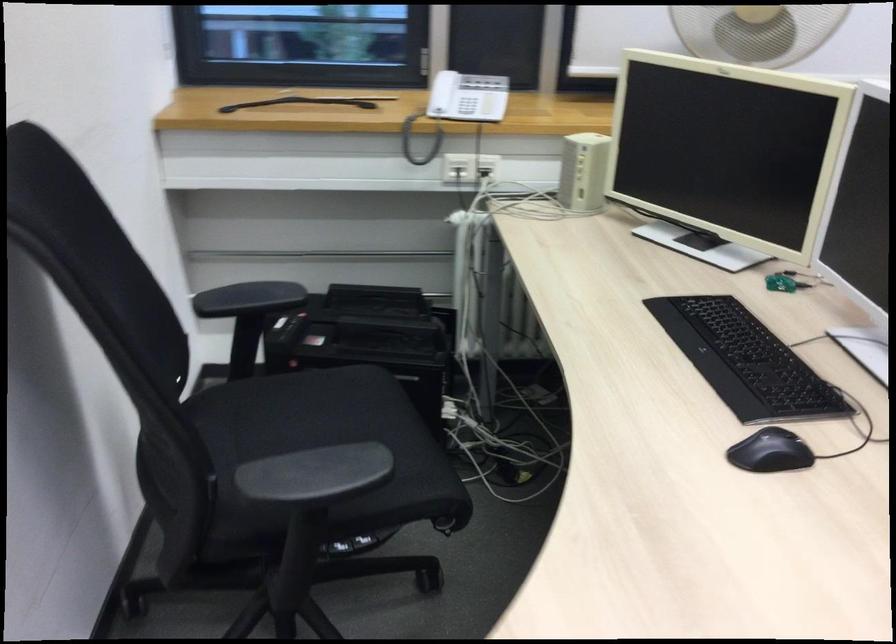
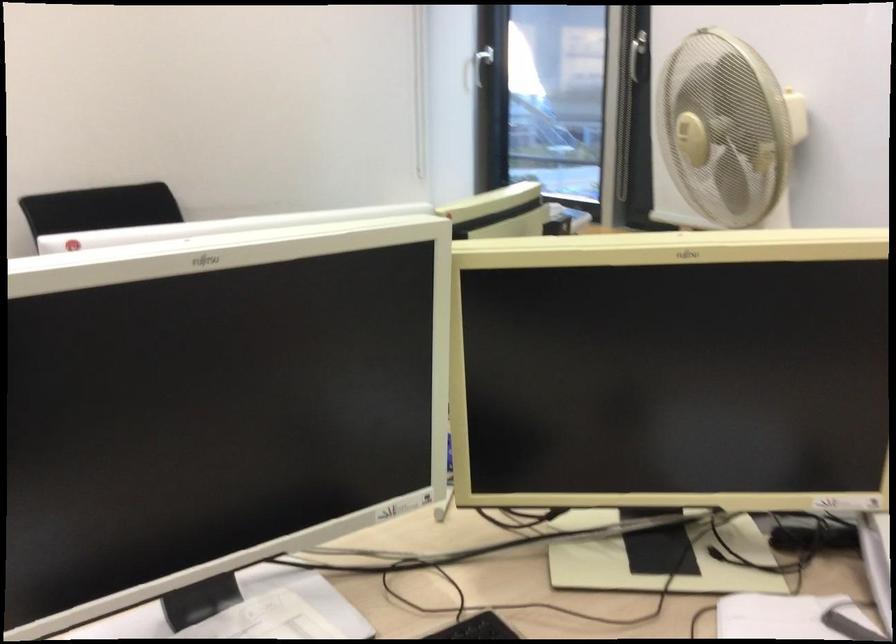
Question: I am providing you with two images of the same scene from different viewpoints. Which of the following objects are not visible in image2?

Choices:
 (A) white window handle
 (B) scanner lid
 (C) black chair sitting surface
 (D) toothbrush in holder

Answer: (C)